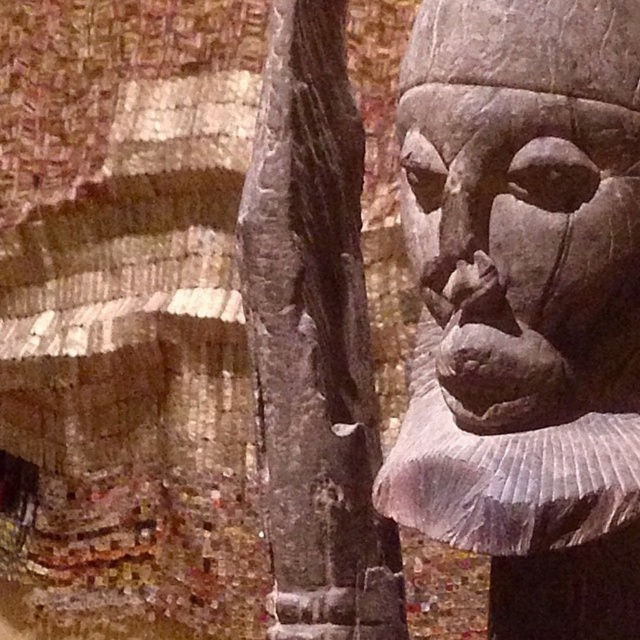
You are a photographer standing at a certain distance from the gray stone head at upper right. You want to take a photo where the head fills the frame perfectly. Given that the recommended distance for such a shot is 90 centimeters, is your current position suitable?

The distance between the gray stone head at upper right and the camera is 91.09 centimeters, which is slightly more than the recommended 90 centimeters. To fill the frame perfectly, you should move about 1 centimeter closer.

You are an art conservator examining the sculpture. You notice the gray stone head at upper right and the dark gray stone pillar at center. Which object is positioned to the right side of the other?

The gray stone head at upper right is to the right of the dark gray stone pillar at center.